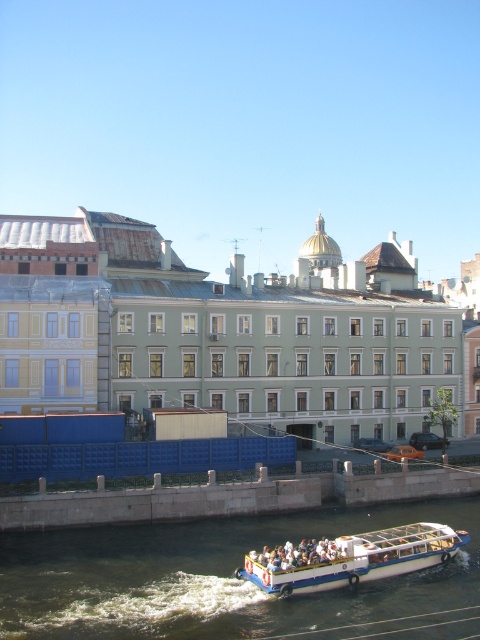
Is dark blue water at center bigger than white plastic boat at lower center?

Yes, dark blue water at center is bigger than white plastic boat at lower center.

Is point (295, 608) positioned before point (416, 544)?

That is True.

Is point (122, 612) positioned before point (408, 564)?

Yes, it is in front of point (408, 564).

The height and width of the screenshot is (640, 480). Identify the location of dark blue water at center. (228, 580).